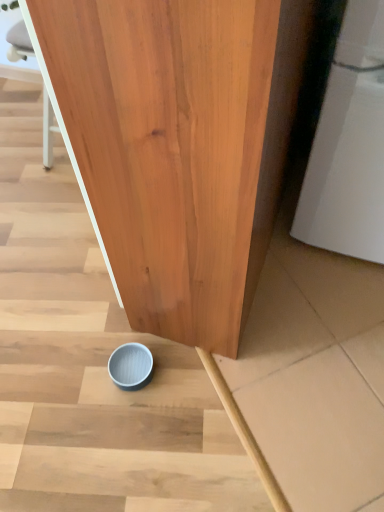
Question: Does blue matte bowl at lower center have a greater width compared to light blue matte bowl at lower center?

Choices:
 (A) yes
 (B) no

Answer: (A)

Question: Considering the relative sizes of blue matte bowl at lower center and light blue matte bowl at lower center in the image provided, is blue matte bowl at lower center bigger than light blue matte bowl at lower center?

Choices:
 (A) yes
 (B) no

Answer: (A)

Question: Does blue matte bowl at lower center have a smaller size compared to light blue matte bowl at lower center?

Choices:
 (A) yes
 (B) no

Answer: (B)

Question: Does blue matte bowl at lower center have a lesser width compared to light blue matte bowl at lower center?

Choices:
 (A) yes
 (B) no

Answer: (B)

Question: Would you say blue matte bowl at lower center is a long distance from light blue matte bowl at lower center?

Choices:
 (A) no
 (B) yes

Answer: (A)

Question: Would you say blue matte bowl at lower center contains light blue matte bowl at lower center?

Choices:
 (A) no
 (B) yes

Answer: (B)

Question: Is light blue matte bowl at lower center bigger than blue matte bowl at lower center?

Choices:
 (A) no
 (B) yes

Answer: (A)

Question: From the image's perspective, is light blue matte bowl at lower center over blue matte bowl at lower center?

Choices:
 (A) yes
 (B) no

Answer: (B)

Question: From a real-world perspective, does light blue matte bowl at lower center stand above blue matte bowl at lower center?

Choices:
 (A) no
 (B) yes

Answer: (A)

Question: Is light blue matte bowl at lower center not inside blue matte bowl at lower center?

Choices:
 (A) no
 (B) yes

Answer: (A)

Question: Does light blue matte bowl at lower center appear on the right side of blue matte bowl at lower center?

Choices:
 (A) no
 (B) yes

Answer: (A)

Question: Is light blue matte bowl at lower center facing away from blue matte bowl at lower center?

Choices:
 (A) no
 (B) yes

Answer: (B)

Question: Based on their sizes in the image, would you say light blue matte bowl at lower center is bigger or smaller than blue matte bowl at lower center?

Choices:
 (A) small
 (B) big

Answer: (A)